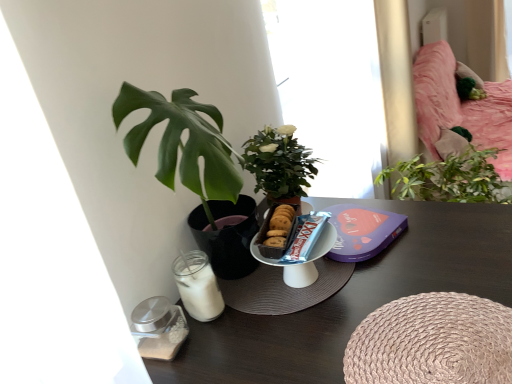
Locate an element on the screen. This screenshot has height=384, width=512. vacant space behind woven beige placemat at lower right is located at coordinates point(436,259).